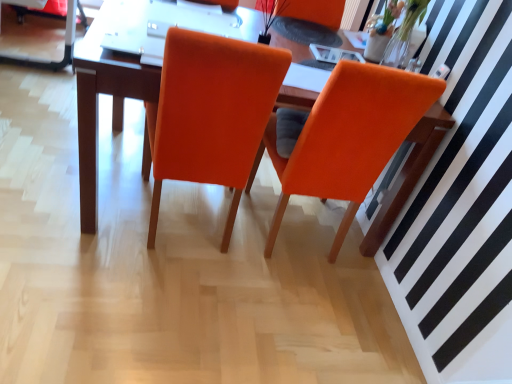
Question: Should I look upward or downward to see orange fabric chair at center, which is the second chair in right-to-left order?

Choices:
 (A) down
 (B) up

Answer: (B)

Question: Does orange fabric chair at center, the second chair when ordered from left to right, have a greater height compared to orange fabric chair at center, the 1th chair viewed from the left?

Choices:
 (A) yes
 (B) no

Answer: (A)

Question: Are orange fabric chair at center, the second chair when ordered from left to right, and orange fabric chair at center, which is the second chair in right-to-left order, far apart?

Choices:
 (A) yes
 (B) no

Answer: (B)

Question: Would you say orange fabric chair at center, which is the second chair in right-to-left order, is part of orange fabric chair at center, which is the first chair from right to left,'s contents?

Choices:
 (A) no
 (B) yes

Answer: (A)

Question: Does orange fabric chair at center, which is the first chair from right to left, appear on the right side of orange fabric chair at center, the 1th chair viewed from the left?

Choices:
 (A) no
 (B) yes

Answer: (B)

Question: Is orange fabric chair at center, which is the first chair from right to left, bigger than orange fabric chair at center, the 1th chair viewed from the left?

Choices:
 (A) yes
 (B) no

Answer: (B)

Question: From the image's perspective, is orange fabric chair at center, the second chair when ordered from left to right, over orange fabric chair at center, which is the second chair in right-to-left order?

Choices:
 (A) yes
 (B) no

Answer: (B)

Question: Can you confirm if matte wood table at center is taller than orange fabric chair at center, which is the first chair from right to left?

Choices:
 (A) no
 (B) yes

Answer: (A)

Question: Would you consider matte wood table at center to be distant from orange fabric chair at center, which is the first chair from right to left?

Choices:
 (A) no
 (B) yes

Answer: (A)

Question: Considering the relative sizes of matte wood table at center and orange fabric chair at center, which is the first chair from right to left, in the image provided, is matte wood table at center bigger than orange fabric chair at center, which is the first chair from right to left,?

Choices:
 (A) yes
 (B) no

Answer: (A)

Question: From the image's perspective, is matte wood table at center beneath orange fabric chair at center, the second chair when ordered from left to right?

Choices:
 (A) no
 (B) yes

Answer: (A)

Question: Is matte wood table at center directly adjacent to orange fabric chair at center, the second chair when ordered from left to right?

Choices:
 (A) yes
 (B) no

Answer: (B)

Question: Is matte wood table at center positioned in front of orange fabric chair at center, which is the first chair from right to left?

Choices:
 (A) no
 (B) yes

Answer: (A)

Question: Would you say orange fabric armchair at upper center is part of matte wood table at center's contents?

Choices:
 (A) yes
 (B) no

Answer: (B)